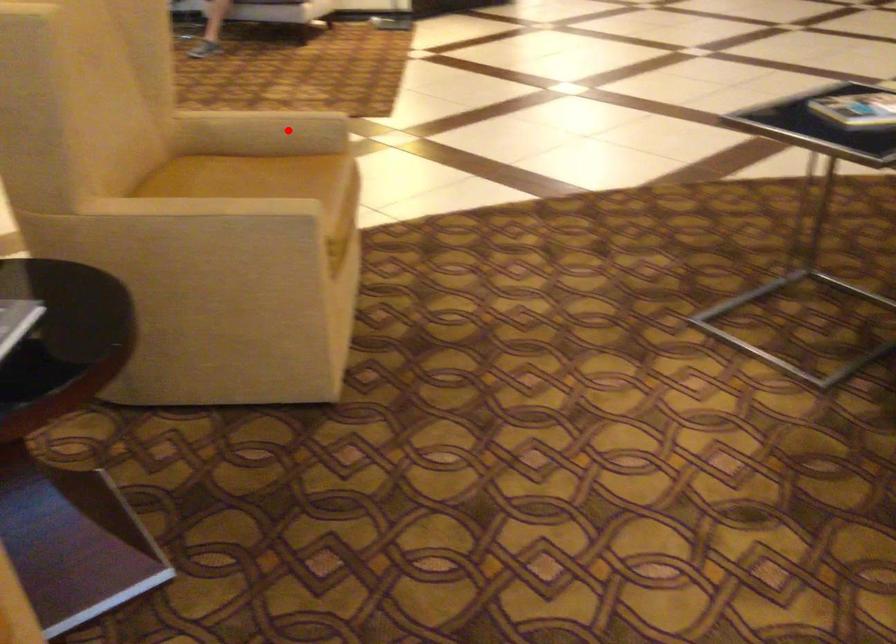
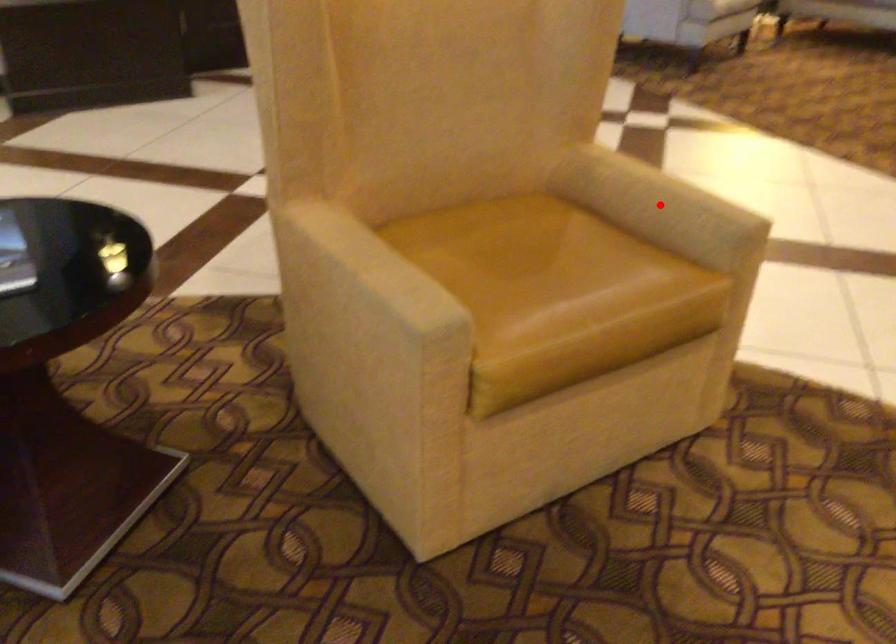
I am providing you with two images of the same scene from different viewpoints. A red point is marked on the first image and another point is marked on the second image. Is the red point in image1 aligned with the point shown in image2?

Yes